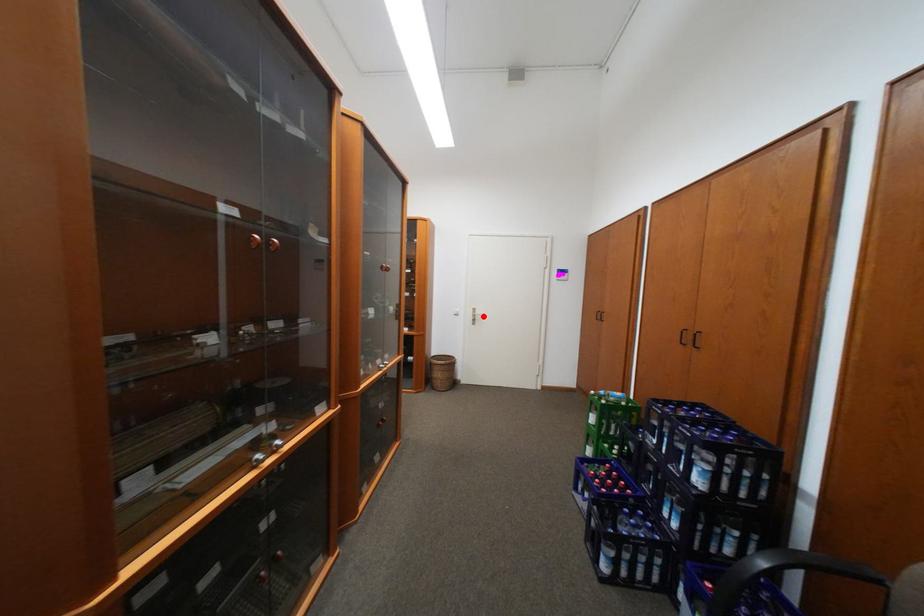
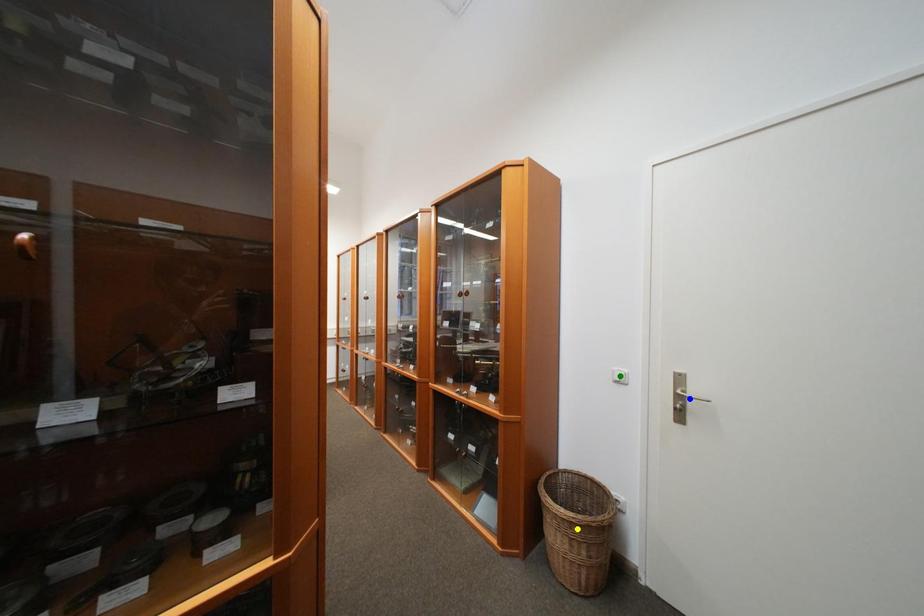
Question: I am providing you with two images of the same scene from different viewpoints. A red point is marked on the first image. You are given multiple points on the second image. Which mark in image 2 goes with the point in image 1?

Choices:
 (A) blue point
 (B) yellow point
 (C) green point

Answer: (A)